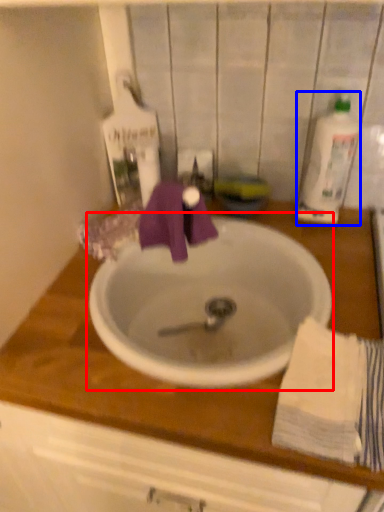
Question: Among these objects, which one is farthest to the camera, sink (highlighted by a red box) or cleaning product (highlighted by a blue box)?

Choices:
 (A) sink
 (B) cleaning product

Answer: (B)